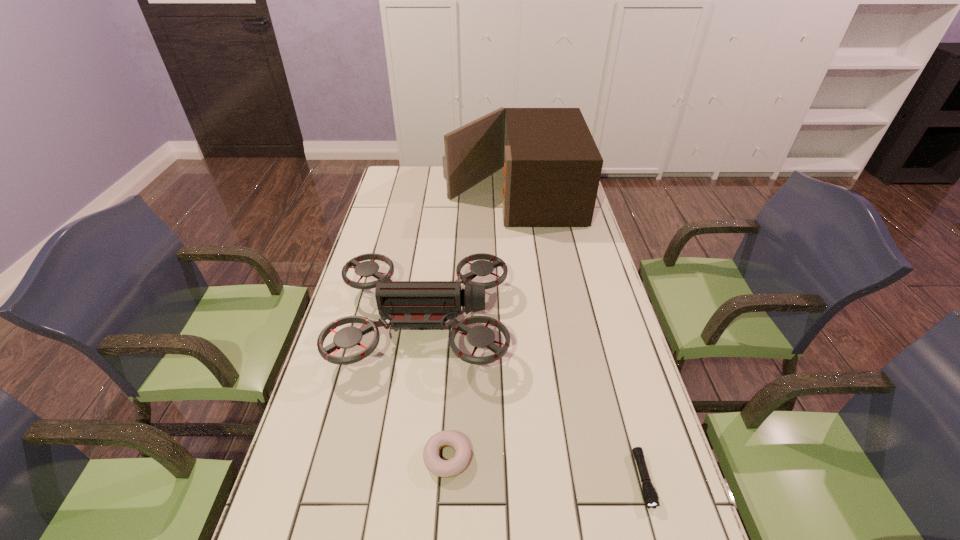
Identify the location of vacant space that is in between the tallest object and the flashlight. (578, 337).

At what (x,y) coordinates should I click in order to perform the action: click on free space between the doughnut and the flashlight. Please return your answer as a coordinate pair (x, y). Image resolution: width=960 pixels, height=540 pixels. Looking at the image, I should click on (545, 468).

This screenshot has height=540, width=960. I want to click on empty space that is in between the shortest object and the microwave oven, so click(x=578, y=337).

What are the coordinates of `vacant space that's between the second shortest object and the shortest object` in the screenshot? It's located at (545, 468).

What are the coordinates of `free spot between the third shortest object and the shortest object` in the screenshot? It's located at (533, 401).

In order to click on vacant space that is in between the farthest object and the flashlight in this screenshot , I will do `click(578, 337)`.

Choose which object is the third nearest neighbor to the farthest object. Please provide its 2D coordinates. Your answer should be formatted as a tuple, i.e. [(x, y)], where the tuple contains the x and y coordinates of a point satisfying the conditions above.

[(650, 496)]

Locate which object ranks second in proximity to the flashlight. Please provide its 2D coordinates. Your answer should be formatted as a tuple, i.e. [(x, y)], where the tuple contains the x and y coordinates of a point satisfying the conditions above.

[(442, 468)]

Identify the location of free space that satisfies the following two spatial constraints: 1. on the front-facing side of the doughnut; 2. on the left side of the second farthest object. (405, 457).

This screenshot has height=540, width=960. I want to click on vacant region that satisfies the following two spatial constraints: 1. on the front-facing side of the third shortest object; 2. on the left side of the third tallest object, so click(x=405, y=457).